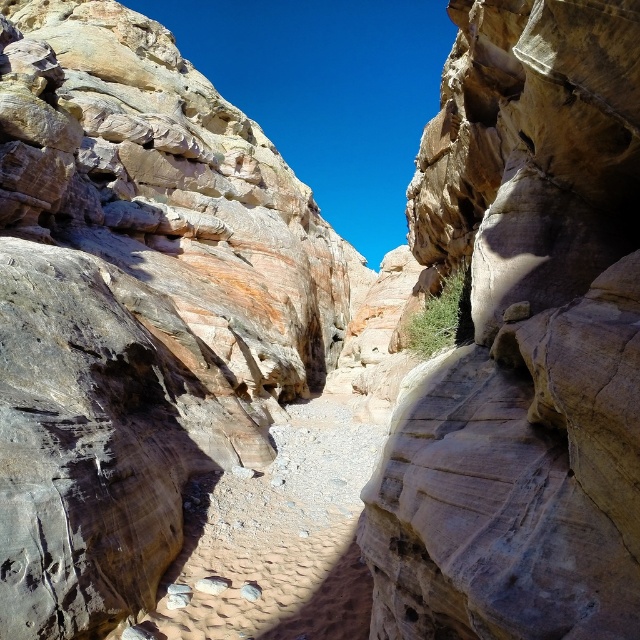
Is rustic sandstone rock face at center shorter than smooth sandstone rock face at center?

In fact, rustic sandstone rock face at center may be taller than smooth sandstone rock face at center.

Can you confirm if rustic sandstone rock face at center is taller than smooth sandstone rock face at center?

Yes.

Between point (24, 248) and point (394, 440), which one is positioned in front?

Positioned in front is point (394, 440).

This screenshot has height=640, width=640. Find the location of `rustic sandstone rock face at center`. rustic sandstone rock face at center is located at coordinates (134, 305).